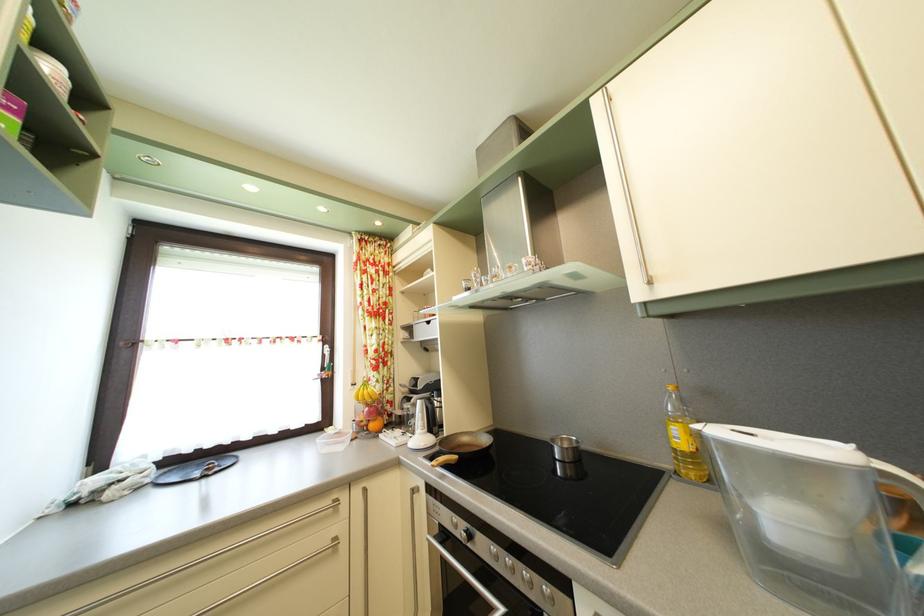
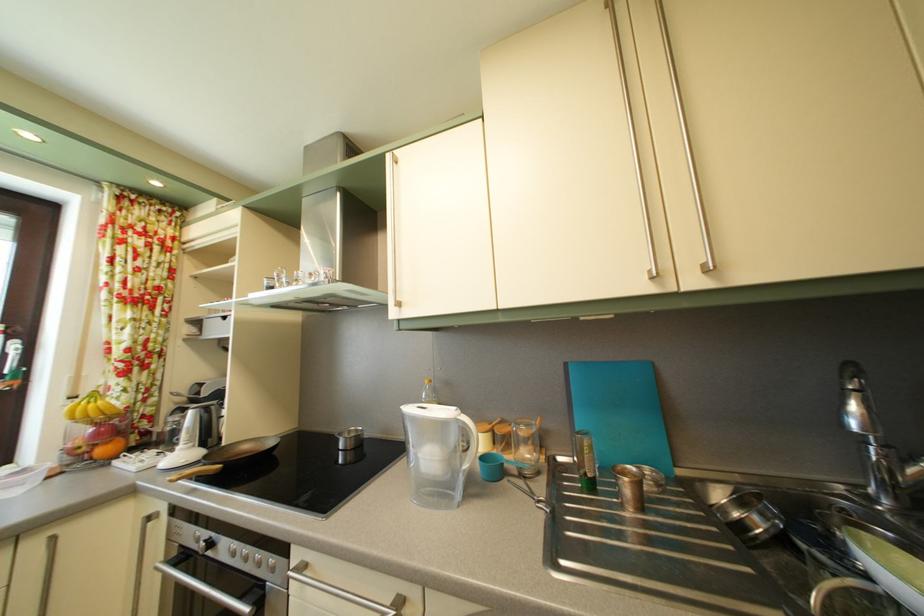
What movement of the cameraman would produce the second image?

The cameraman moved toward right, backward.